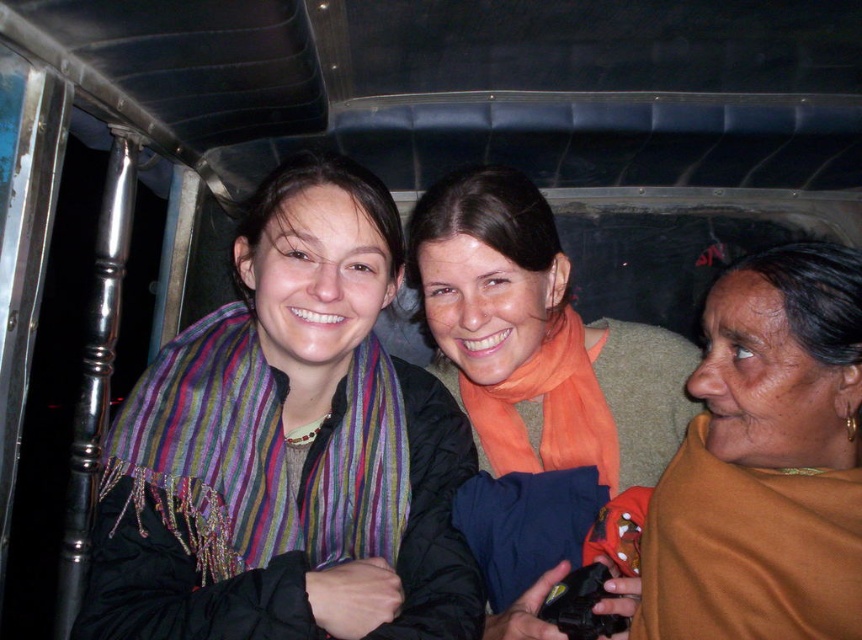
Question: Which object appears closest to the camera in this image?

Choices:
 (A) multicolored woven scarf at left
 (B) brown fabric at right
 (C) orange scarf at center

Answer: (B)

Question: Which object appears farthest from the camera in this image?

Choices:
 (A) orange silk scarf at center
 (B) brown fabric at right

Answer: (A)

Question: Does orange scarf at center have a lesser width compared to multicolored woven scarf at left?

Choices:
 (A) no
 (B) yes

Answer: (A)

Question: Among these points, which one is farthest from the camera?

Choices:
 (A) (576, 368)
 (B) (192, 552)
 (C) (163, 428)
 (D) (592, 420)

Answer: (A)

Question: Does orange scarf at center appear on the right side of multicolored woven scarf at left?

Choices:
 (A) yes
 (B) no

Answer: (A)

Question: Is orange scarf at center smaller than brown fabric at right?

Choices:
 (A) yes
 (B) no

Answer: (B)